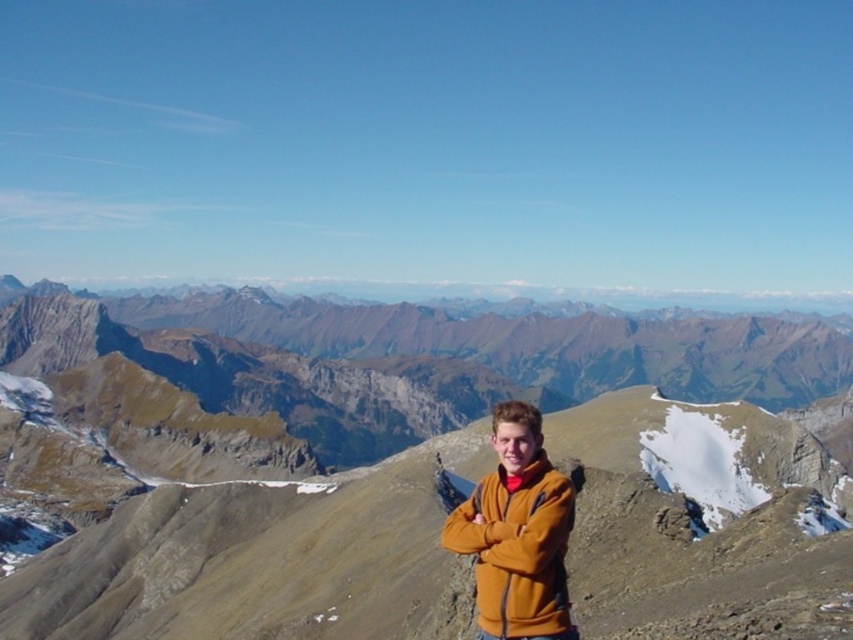
Question: Observing the image, what is the correct spatial positioning of brown rocky mountain at center in reference to orange fleece jacket at center?

Choices:
 (A) left
 (B) right

Answer: (A)

Question: Is brown rocky mountain at center wider than orange fleece jacket at center?

Choices:
 (A) yes
 (B) no

Answer: (A)

Question: Which point is farther to the camera?

Choices:
 (A) orange fleece jacket at center
 (B) brown rocky mountain at center

Answer: (B)

Question: Which point is farther to the camera?

Choices:
 (A) (830, 480)
 (B) (534, 636)

Answer: (A)

Question: Can you confirm if brown rocky mountain at center is smaller than orange fleece jacket at center?

Choices:
 (A) no
 (B) yes

Answer: (A)

Question: Which point appears farthest from the camera in this image?

Choices:
 (A) (553, 634)
 (B) (207, 580)

Answer: (B)